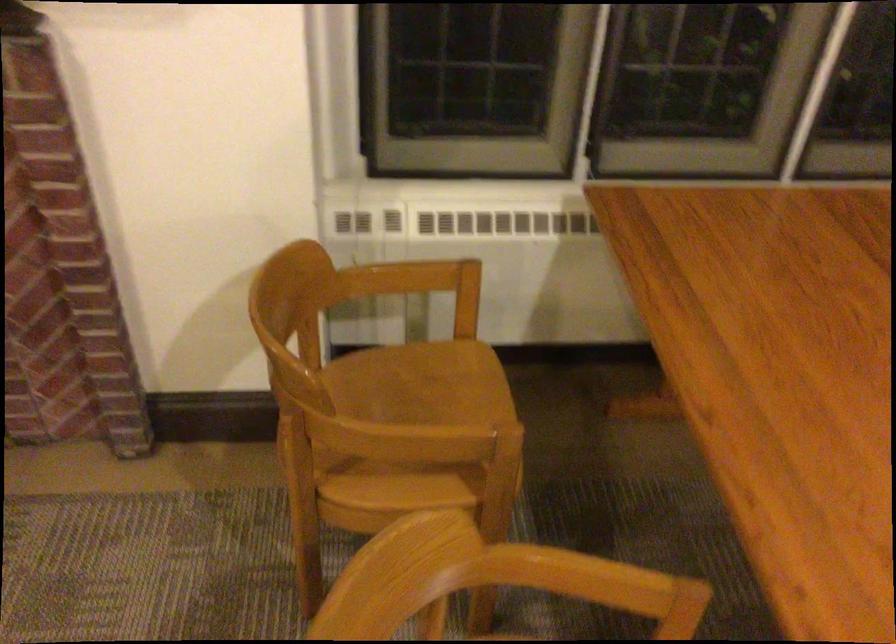
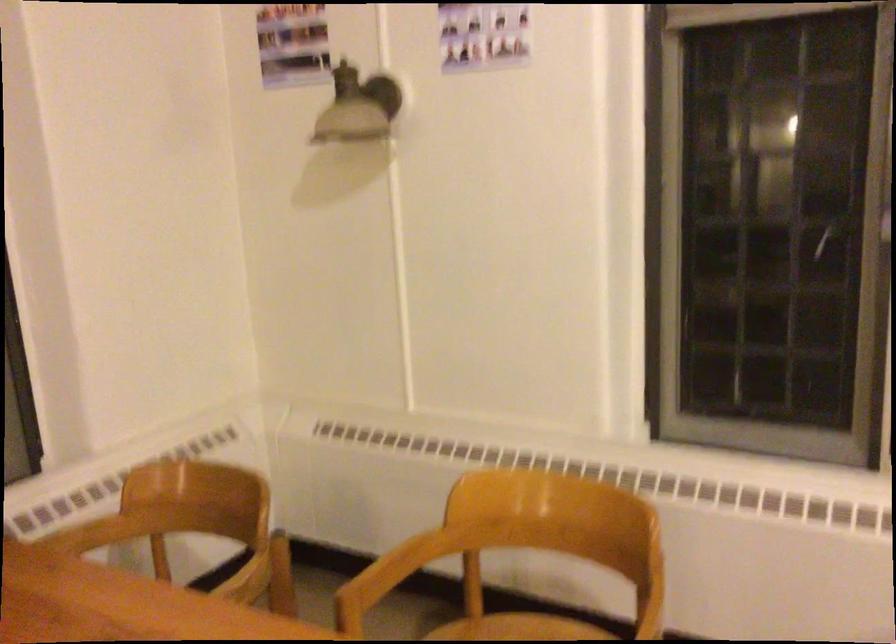
Question: How did the camera likely rotate?

Choices:
 (A) Left
 (B) Right
 (C) Up
 (D) Down

Answer: (B)